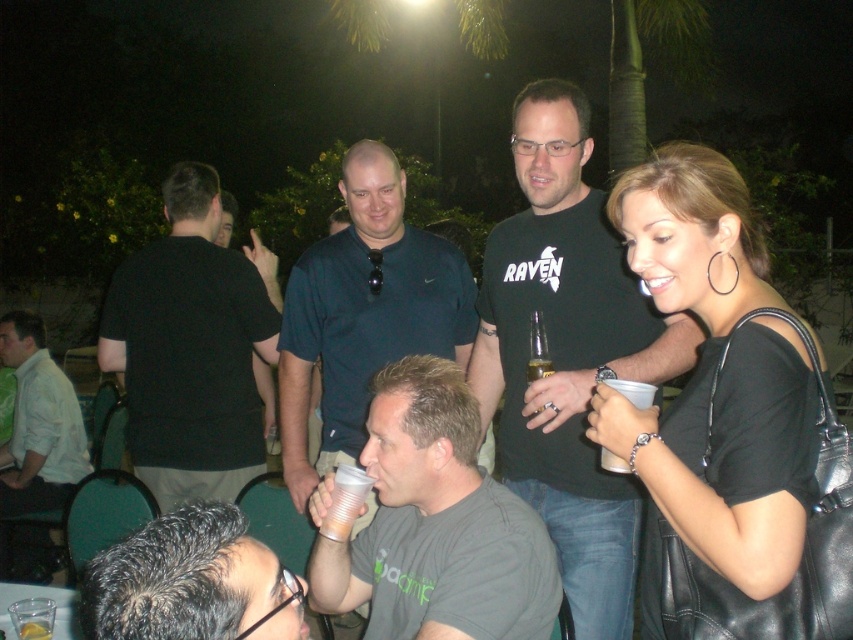
Can you confirm if black cotton t-shirt at center is shorter than gray matte t-shirt at center?

Incorrect, black cotton t-shirt at center's height does not fall short of gray matte t-shirt at center's.

Which is below, black cotton t-shirt at center or gray matte t-shirt at center?

gray matte t-shirt at center

The width and height of the screenshot is (853, 640). What do you see at coordinates (567, 355) in the screenshot?
I see `black cotton t-shirt at center` at bounding box center [567, 355].

At what (x,y) coordinates should I click in order to perform the action: click on black cotton t-shirt at center. Please return your answer as a coordinate pair (x, y). Looking at the image, I should click on (567, 355).

Describe the element at coordinates (715, 385) in the screenshot. The image size is (853, 640). I see `black leather purse at right` at that location.

Is point (675, 202) positioned in front of point (19, 627)?

Yes, point (675, 202) is in front of point (19, 627).

In order to click on black leather purse at right in this screenshot , I will do `click(715, 385)`.

Which is behind, point (529, 241) or point (207, 474)?

The point (207, 474) is behind.

Which of these two, black cotton t-shirt at center or black matte shirt at left, stands shorter?

black matte shirt at left

Does point (577, 355) come in front of point (183, 408)?

Yes, it is in front of point (183, 408).

Find the location of a particular element. black cotton t-shirt at center is located at coordinates (567, 355).